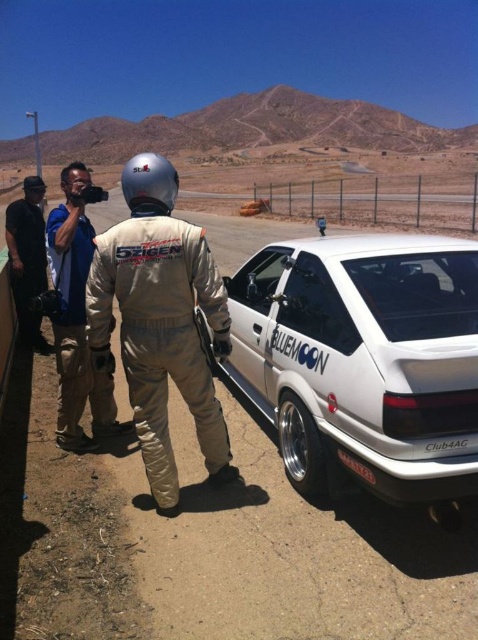
Question: Which point is farther to the camera?

Choices:
 (A) tan fabric suit at center
 (B) black plastic license plate at lower center

Answer: (A)

Question: Which point appears farthest from the camera in this image?

Choices:
 (A) [x=138, y=163]
 (B) [x=369, y=474]
 (C) [x=181, y=362]

Answer: (C)

Question: Can you confirm if white glossy hatchback at center is positioned to the left of silver metallic helmet at center?

Choices:
 (A) yes
 (B) no

Answer: (B)

Question: Which point appears farthest from the camera in this image?

Choices:
 (A) (108, 317)
 (B) (73, 401)
 (C) (156, 156)

Answer: (B)

Question: Can you confirm if tan fabric suit at center is positioned to the right of black plastic license plate at lower center?

Choices:
 (A) yes
 (B) no

Answer: (B)

Question: Does black leather jacket at left have a smaller size compared to black plastic license plate at lower center?

Choices:
 (A) no
 (B) yes

Answer: (A)